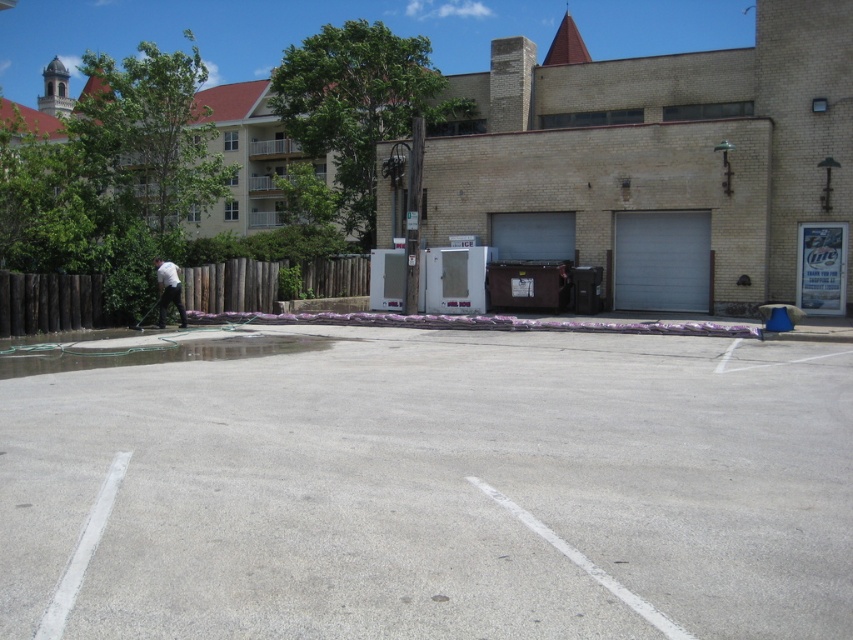
You are a delivery driver who needs to park your truck in the gray concrete parking lot at center. The parking lot has a maximum weight limit of 10 tons. Can you safely park your truck there?

The gray concrete parking lot at center can safely accommodate the truck as there is no information provided about its weight capacity exceeding the 10 ton limit.

You are standing in the parking lot and want to walk towards the two points marked in the image. Which point will you reach first, point (175, 620) or point (6, 358)?

You will reach point (175, 620) first because it is closer to you than point (6, 358).

You are standing in the parking lot and want to walk from the camera to the point labeled as point (165, 273). Which direction should you head relative to the point labeled as point (701, 392)?

Since point (701, 392) is closer to the camera than point (165, 273), you should head away from point (701, 392) to reach point (165, 273).